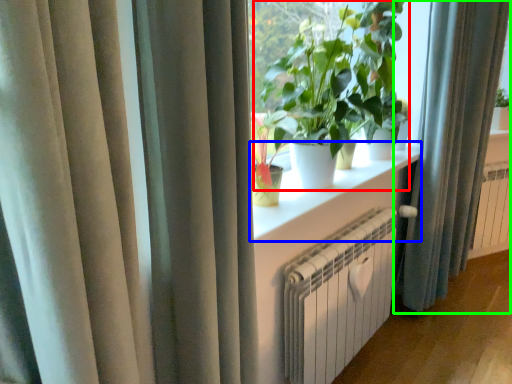
Question: Which object is the farthest from houseplant (highlighted by a red box)? Choose among these: window sill (highlighted by a blue box) or curtain (highlighted by a green box).

Choices:
 (A) window sill
 (B) curtain

Answer: (B)